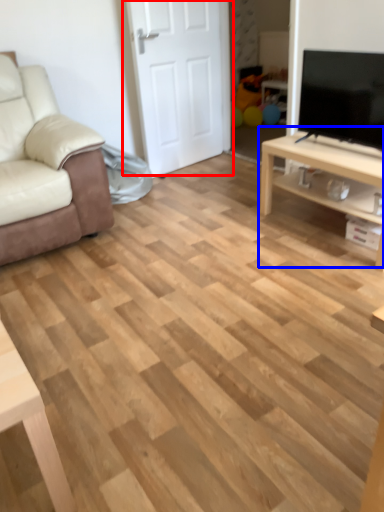
Question: Which object is closer to the camera taking this photo, door (highlighted by a red box) or table (highlighted by a blue box)?

Choices:
 (A) door
 (B) table

Answer: (B)